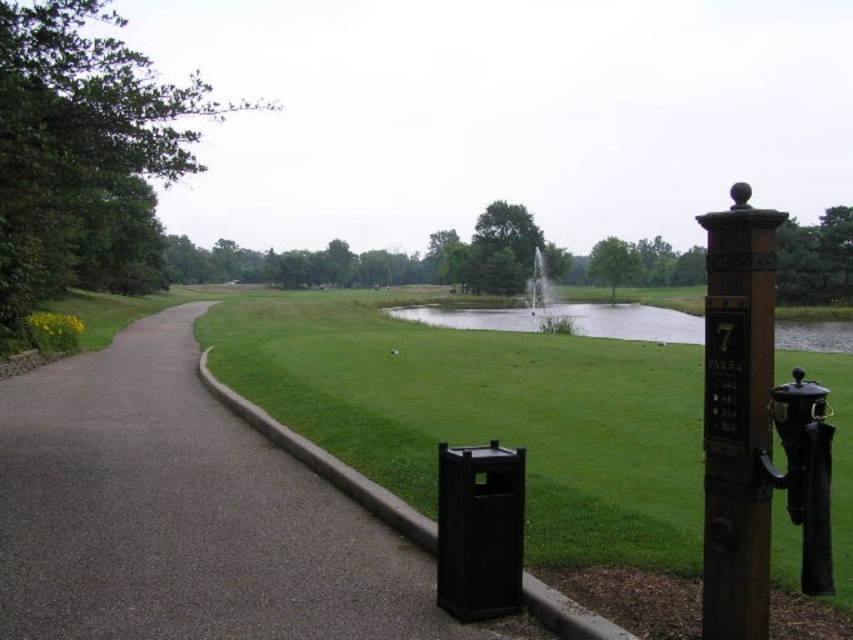
Who is positioned more to the right, dark gray asphalt at left or green grass at center?

green grass at center

Does dark gray asphalt at left have a smaller size compared to green grass at center?

Yes.

Which is in front, point (396, 570) or point (782, 376)?

Positioned in front is point (396, 570).

The height and width of the screenshot is (640, 853). Identify the location of dark gray asphalt at left. (184, 515).

Can you confirm if green grass at center is bigger than green grassy lake at center?

No.

Is green grass at center taller than green grassy lake at center?

Incorrect, green grass at center's height is not larger of green grassy lake at center's.

Between point (457, 413) and point (694, 328), which one is positioned behind?

Positioned behind is point (694, 328).

You are a GUI agent. You are given a task and a screenshot of the screen. Output one action in this format:
    pyautogui.click(x=<x>, y=<y>)
    Task: Click on the green grass at center
    The image size is (853, 640).
    Given the screenshot: What is the action you would take?
    pyautogui.click(x=485, y=413)

Measure the distance between dark gray asphalt at left and green grassy lake at center.

The distance of dark gray asphalt at left from green grassy lake at center is 152.11 feet.

The height and width of the screenshot is (640, 853). Identify the location of dark gray asphalt at left. (184, 515).

Between point (248, 620) and point (643, 333), which one is positioned behind?

The point (643, 333) is behind.

The width and height of the screenshot is (853, 640). Identify the location of dark gray asphalt at left. (184, 515).